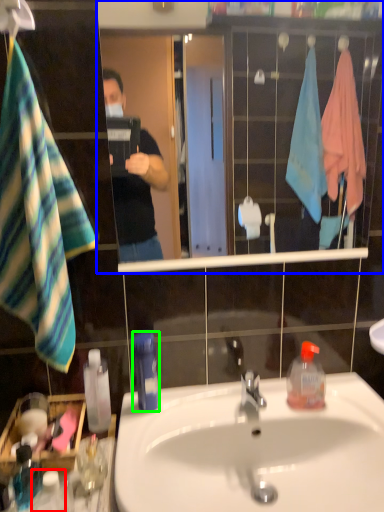
Question: Estimate the real-world distances between objects in this image. Which object is farther from bottle (highlighted by a red box), mirror (highlighted by a blue box) or bottle (highlighted by a green box)?

Choices:
 (A) mirror
 (B) bottle

Answer: (A)